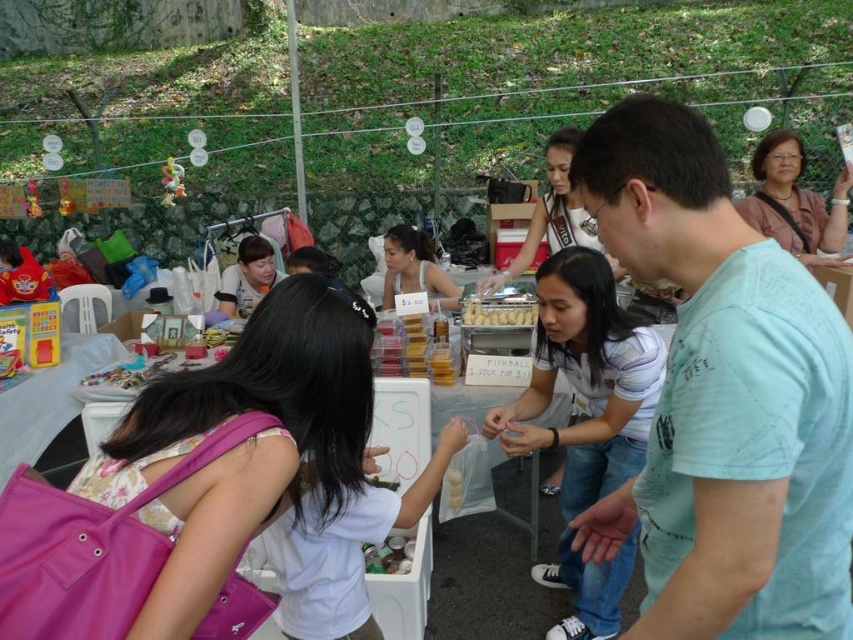
Who is more distant from viewer, (795, 141) or (241, 276)?

Point (241, 276)

Which is behind, point (804, 150) or point (254, 284)?

Point (254, 284)

This screenshot has height=640, width=853. Find the location of `matte brown hair at upper right`. matte brown hair at upper right is located at coordinates (795, 202).

Which is behind, point (485, 307) or point (166, 188)?

The point (166, 188) is behind.

Between yellow matte candy at center and plush yellow bear at upper left, which one appears on the right side from the viewer's perspective?

Positioned to the right is yellow matte candy at center.

Is point (465, 312) positioned after point (177, 179)?

No, (465, 312) is closer to viewer.

Find the location of `yellow matte candy at center`. yellow matte candy at center is located at coordinates (498, 310).

Who is lower down, yellow matte candy at center or plush yellow toy at upper left?

yellow matte candy at center is below.

At what (x,y) coordinates should I click in order to perform the action: click on yellow matte candy at center. Please return your answer as a coordinate pair (x, y). The image size is (853, 640). Looking at the image, I should click on (498, 310).